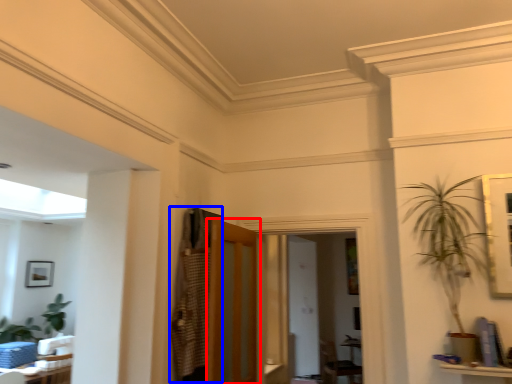
Question: Which object is further to the camera taking this photo, door (highlighted by a red box) or armoire (highlighted by a blue box)?

Choices:
 (A) door
 (B) armoire

Answer: (B)